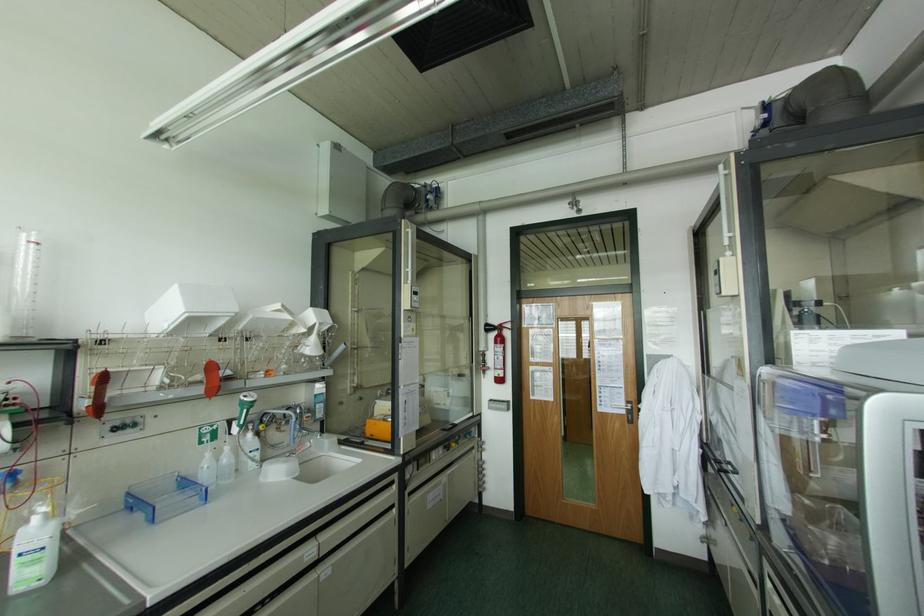
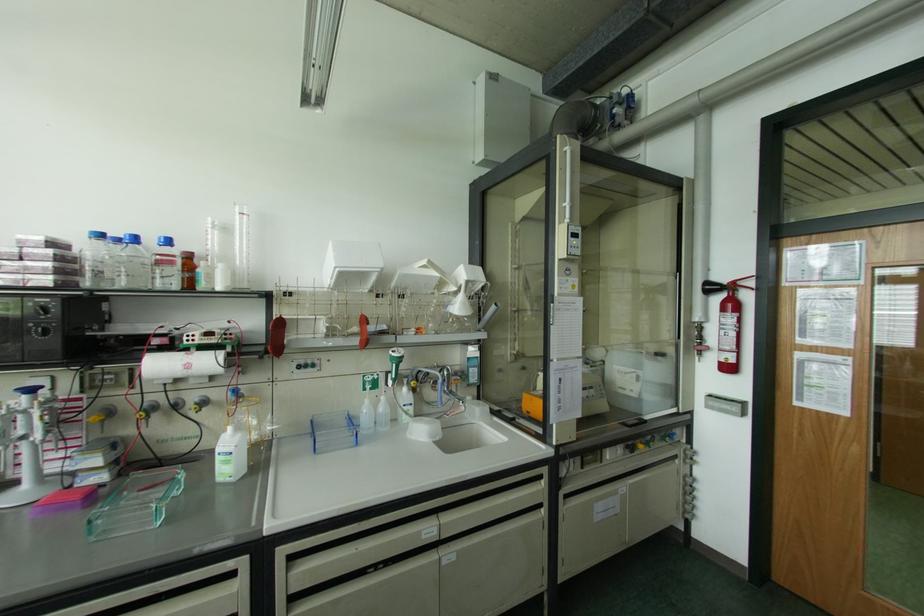
Find the pixel in the second image that matches the point at 499,328 in the first image.

(732, 286)